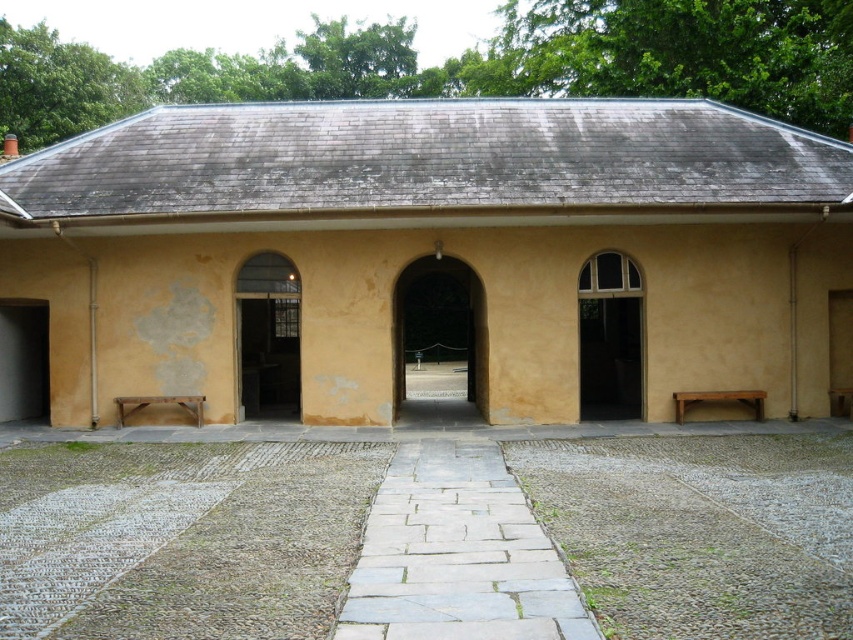
Which is below, clear glass door at center or matte glass door at center?

matte glass door at center

Does clear glass door at center have a greater width compared to matte glass door at center?

No.

Who is more distant from viewer, (631, 333) or (247, 284)?

The point (631, 333) is more distant.

What are the coordinates of `clear glass door at center` in the screenshot? It's located at (610, 337).

Can you confirm if smooth stone archway at center is positioned below matte glass door at center?

No, smooth stone archway at center is not below matte glass door at center.

Who is shorter, smooth stone archway at center or matte glass door at center?

matte glass door at center is shorter.

Who is more forward, (393,412) or (289,305)?

Point (393,412)

You are a GUI agent. You are given a task and a screenshot of the screen. Output one action in this format:
    pyautogui.click(x=<x>, y=<y>)
    Task: Click on the smooth stone archway at center
    This screenshot has width=853, height=640.
    Given the screenshot: What is the action you would take?
    pyautogui.click(x=439, y=321)

What do you see at coordinates (610, 337) in the screenshot? I see `clear glass door at center` at bounding box center [610, 337].

Can you confirm if clear glass door at center is positioned to the left of smooth stone archway at center?

In fact, clear glass door at center is to the right of smooth stone archway at center.

Locate an element on the screen. Image resolution: width=853 pixels, height=640 pixels. clear glass door at center is located at coordinates (610, 337).

Locate an element on the screen. clear glass door at center is located at coordinates (610, 337).